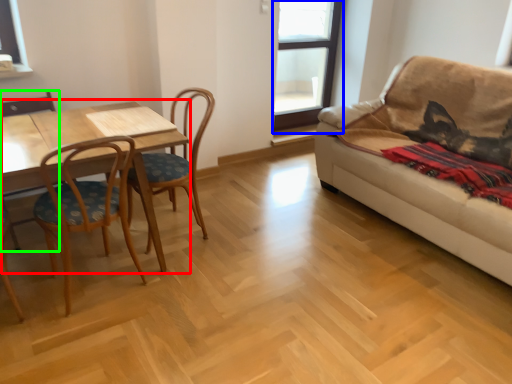
Question: Which object is the closest to the table (highlighted by a red box)? Choose among these: window (highlighted by a blue box) or armchair (highlighted by a green box).

Choices:
 (A) window
 (B) armchair

Answer: (B)